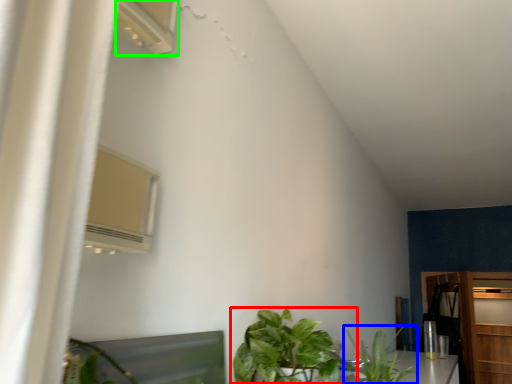
Question: Based on their relative distances, which object is farther from houseplant (highlighted by a red box)? Choose from houseplant (highlighted by a blue box) and air conditioner (highlighted by a green box).

Choices:
 (A) houseplant
 (B) air conditioner

Answer: (B)